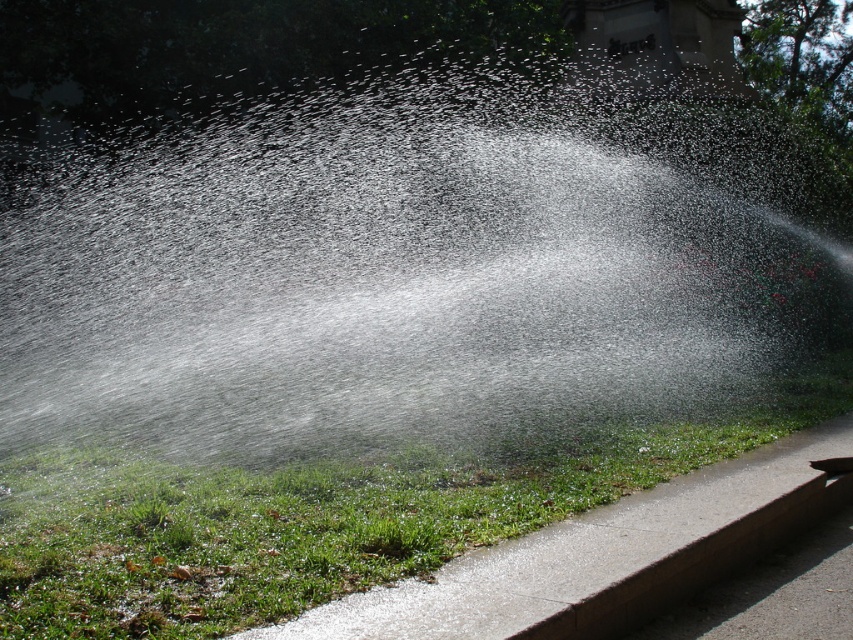
Between point (201, 451) and point (108, 556), which one is positioned in front?

Point (108, 556)

Between transparent water at center and green grass at lower left, which one is positioned higher?

transparent water at center is higher up.

Is point (325, 272) positioned in front of point (9, 570)?

No, it is not.

Where is `transparent water at center`? The height and width of the screenshot is (640, 853). transparent water at center is located at coordinates (407, 269).